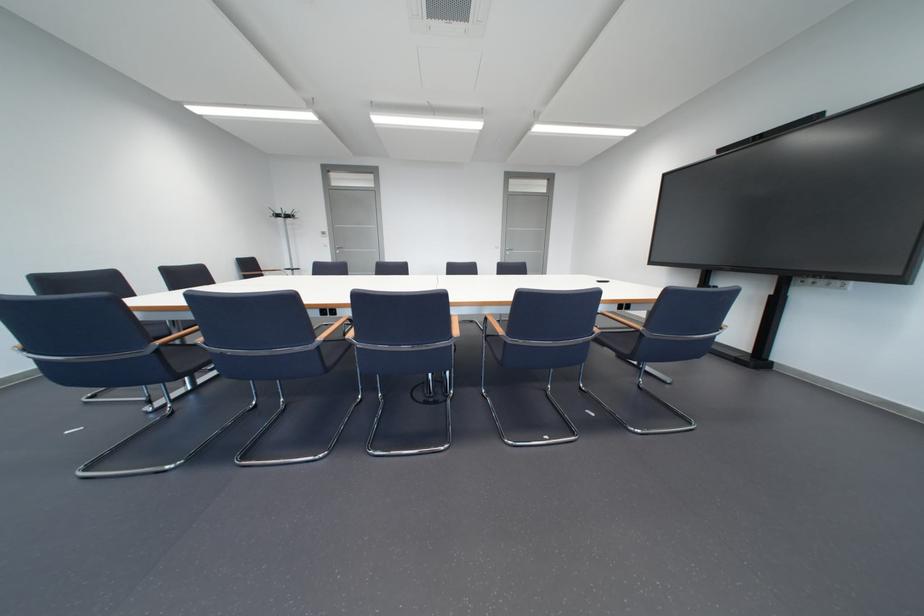
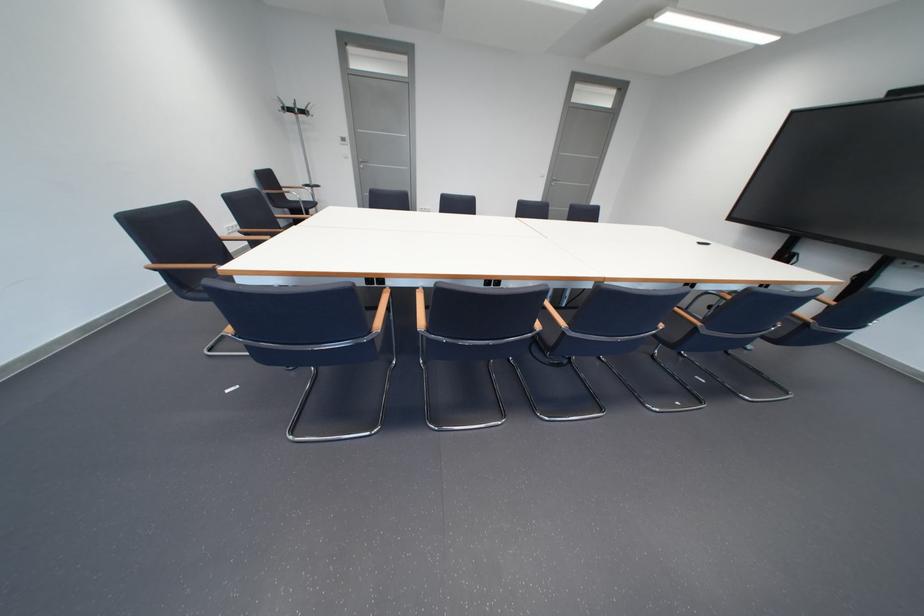
Where in the second image is the point corresponding to (x=292, y=217) from the first image?

(304, 111)